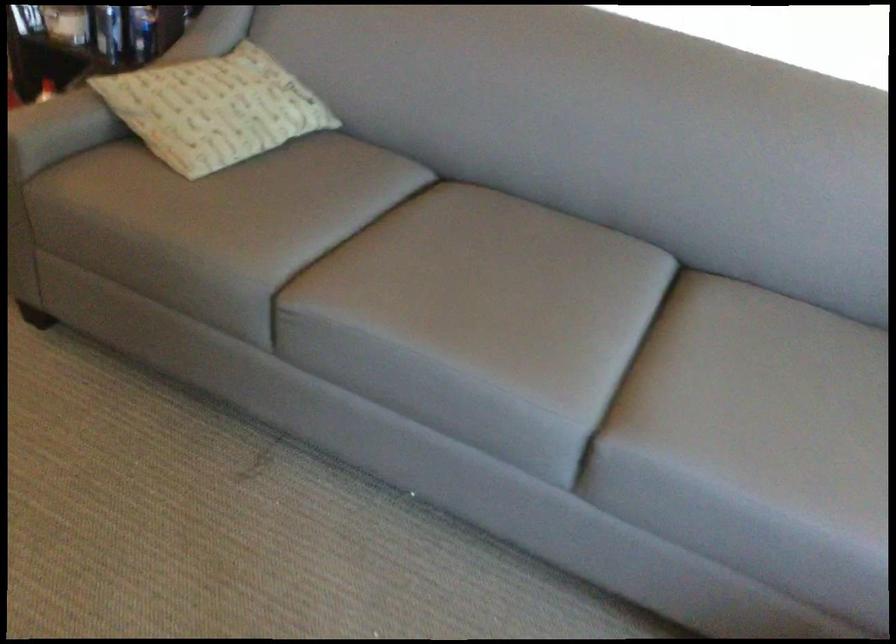
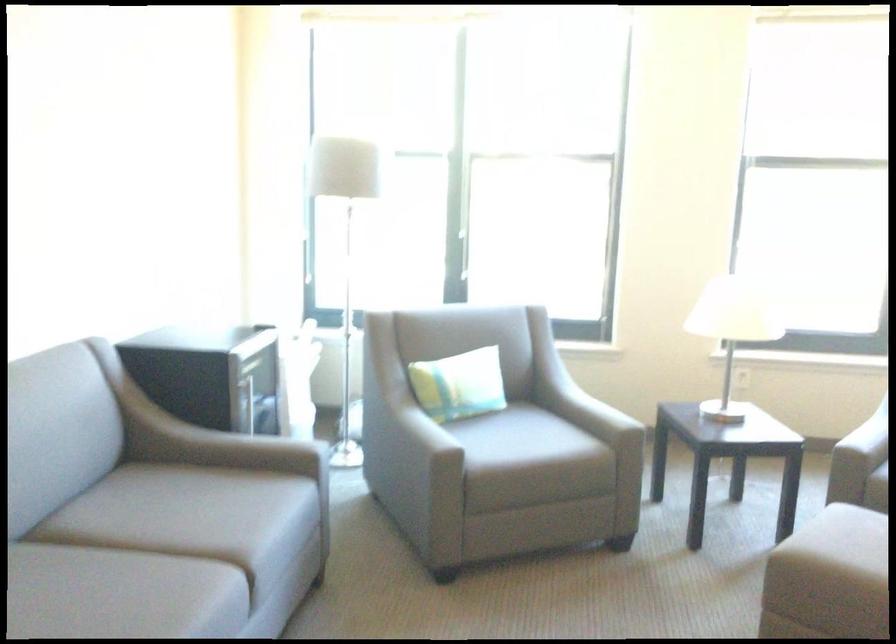
Find the pixel in the second image that matches (x=547, y=322) in the first image.

(119, 594)